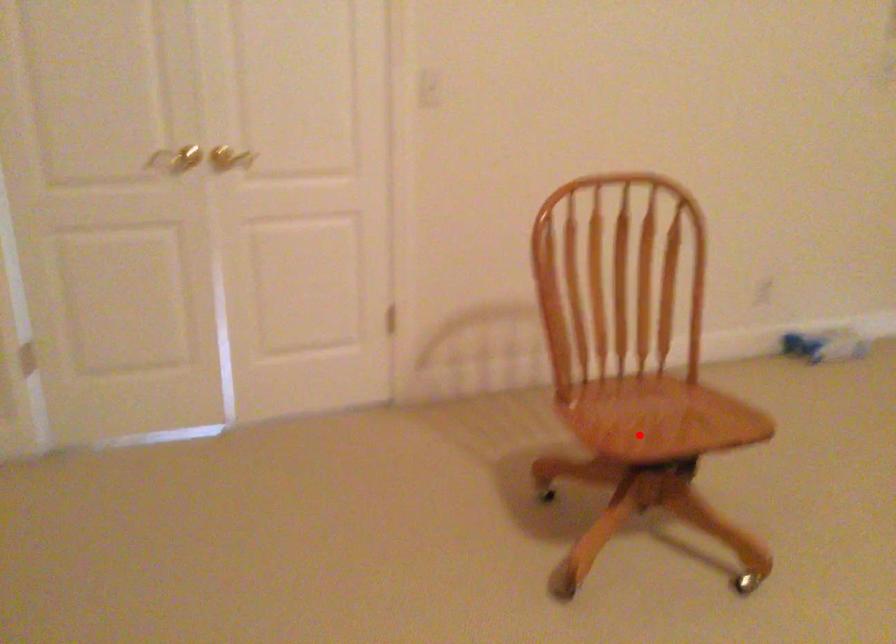
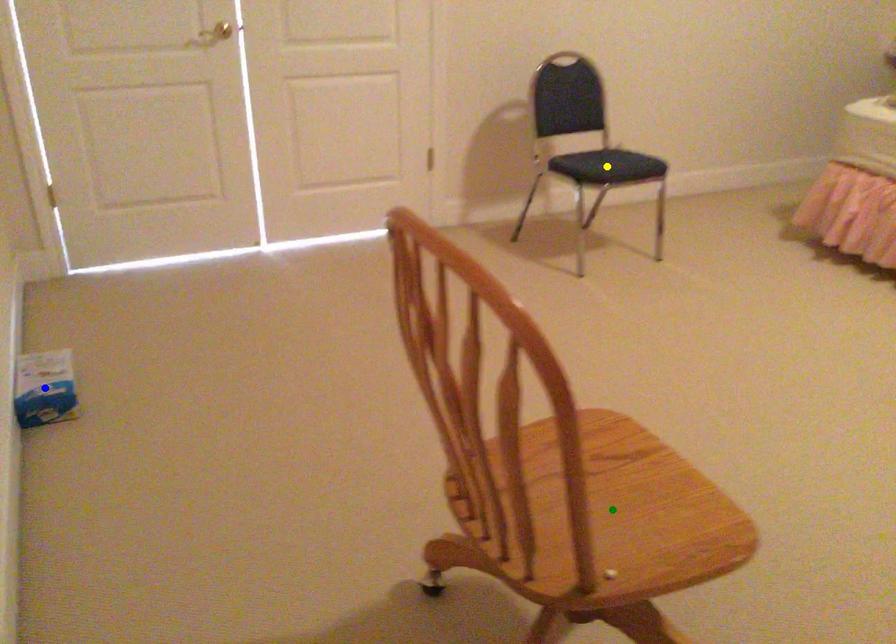
Question: I am providing you with two images of the same scene from different viewpoints. A red point is marked on the first image. You are given multiple points on the second image. Can you choose the point in image 2 that corresponds to the point in image 1?

Choices:
 (A) green point
 (B) blue point
 (C) yellow point

Answer: (A)